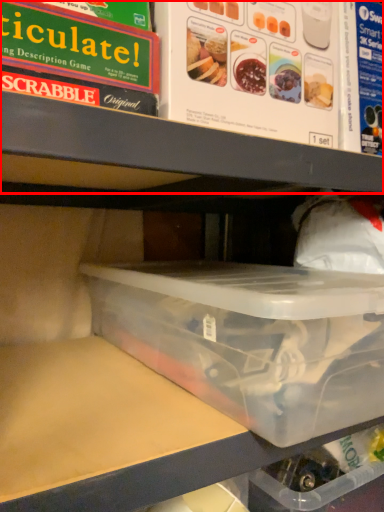
Question: Considering the relative positions of shelf (annotated by the red box) and box in the image provided, where is shelf (annotated by the red box) located with respect to the staircase?

Choices:
 (A) left
 (B) right

Answer: (A)